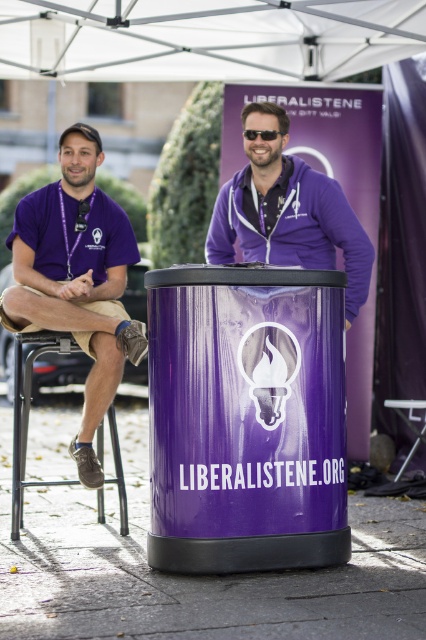
In the scene shown: Is matte purple shirt at left below metallic silver stool at lower right?

No, matte purple shirt at left is not below metallic silver stool at lower right.

Can you confirm if matte purple shirt at left is positioned to the right of metallic silver stool at lower right?

Incorrect, matte purple shirt at left is not on the right side of metallic silver stool at lower right.

Between point (46, 317) and point (414, 448), which one is positioned behind?

The point (414, 448) is more distant.

Find the location of a particular element. The height and width of the screenshot is (640, 426). matte purple shirt at left is located at coordinates (77, 278).

In the scene shown: Who is more distant from viewer, (x=39, y=232) or (x=316, y=262)?

Positioned behind is point (x=316, y=262).

I want to click on matte purple shirt at left, so click(77, 278).

Identify the location of purple matte jacket at center. (287, 212).

Does purple matte jacket at center appear on the left side of metallic black chair at lower left?

No, purple matte jacket at center is not to the left of metallic black chair at lower left.

What do you see at coordinates (287, 212) in the screenshot? The width and height of the screenshot is (426, 640). I see `purple matte jacket at center` at bounding box center [287, 212].

The image size is (426, 640). I want to click on purple matte jacket at center, so click(x=287, y=212).